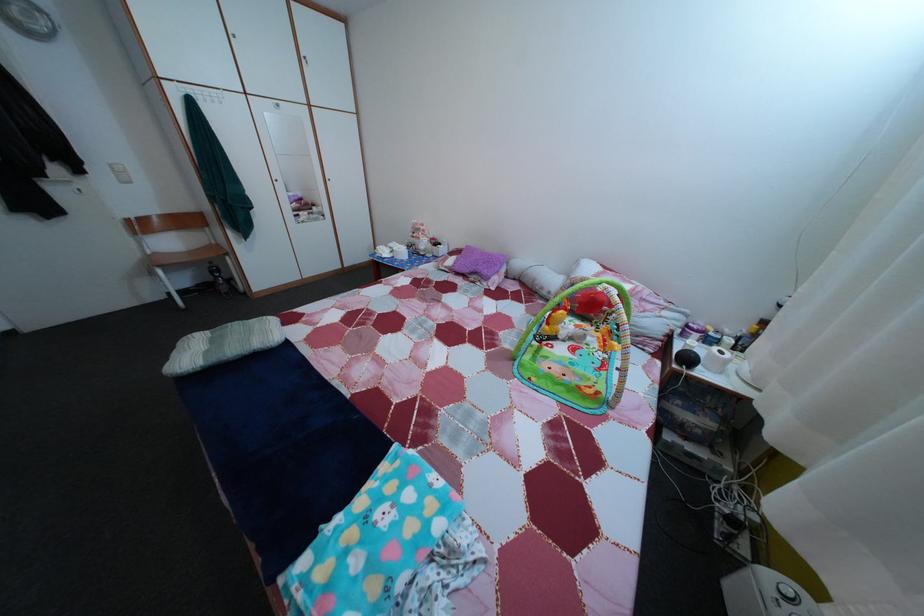
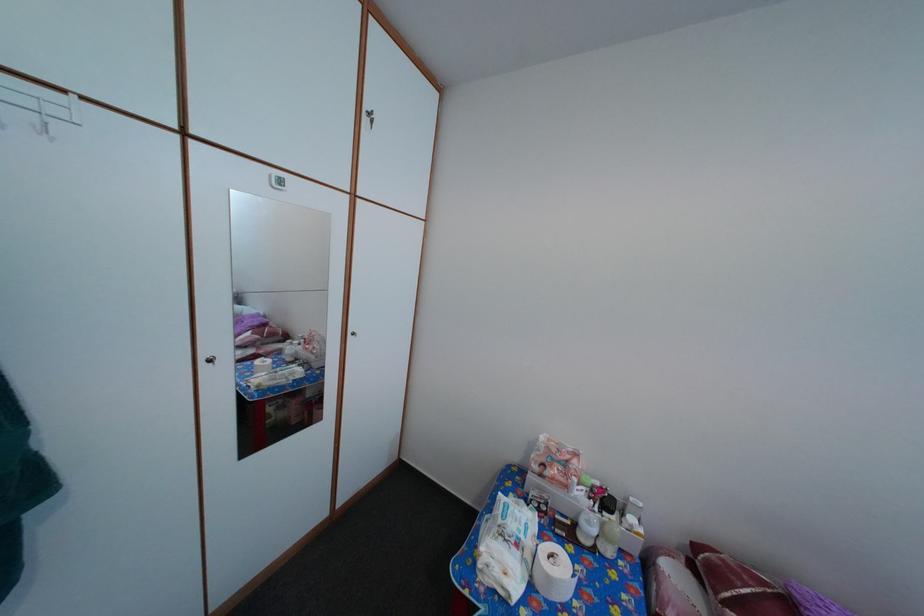
Find the pixel in the second image that matches (430,237) in the first image.

(576, 469)